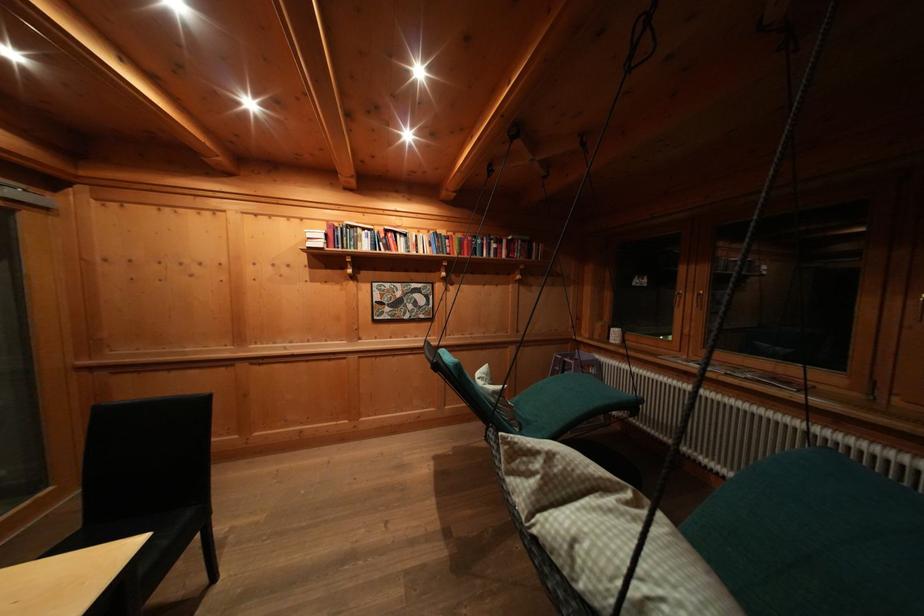
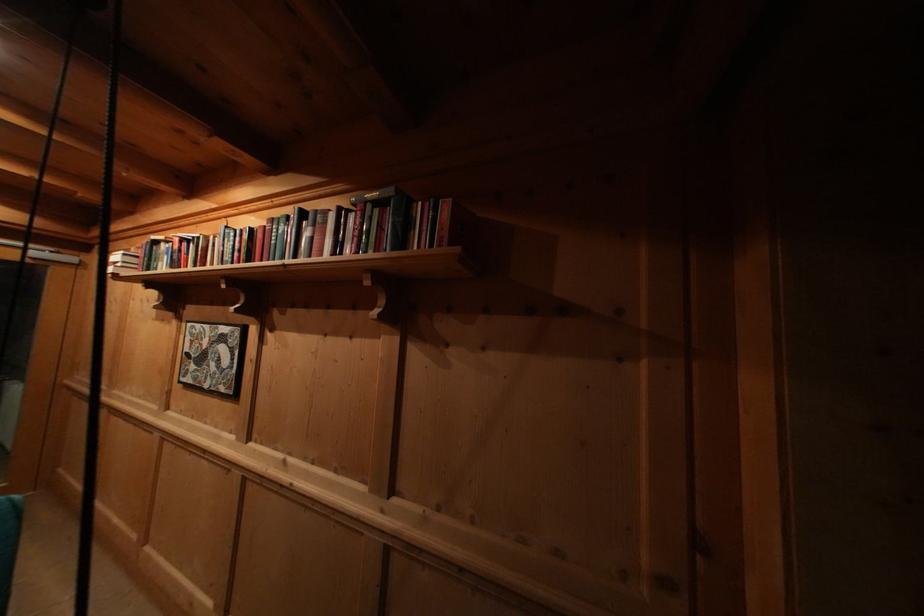
The point at (394,290) is marked in the first image. Where is the corresponding point in the second image?

(204, 331)